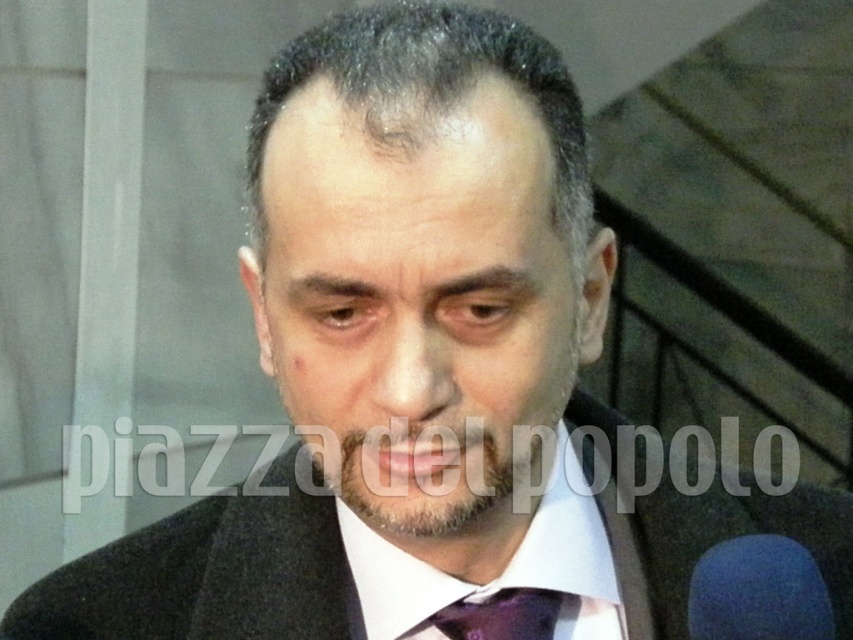
Question: Which point is closer to the camera?

Choices:
 (A) (288, 189)
 (B) (273, 508)

Answer: (A)

Question: Which point appears farthest from the camera in this image?

Choices:
 (A) (350, 476)
 (B) (466, 612)
 (C) (71, 596)

Answer: (C)

Question: Is smooth skin face at center to the right of purple satin tie at center from the viewer's perspective?

Choices:
 (A) yes
 (B) no

Answer: (B)

Question: Which object appears farthest from the camera in this image?

Choices:
 (A) purple satin tie at center
 (B) smooth skin face at center
 (C) dark gray wool suit at center

Answer: (A)

Question: Does smooth skin face at center appear on the left side of dark gray wool suit at center?

Choices:
 (A) no
 (B) yes

Answer: (B)

Question: Does smooth skin face at center have a smaller size compared to dark gray wool suit at center?

Choices:
 (A) no
 (B) yes

Answer: (A)